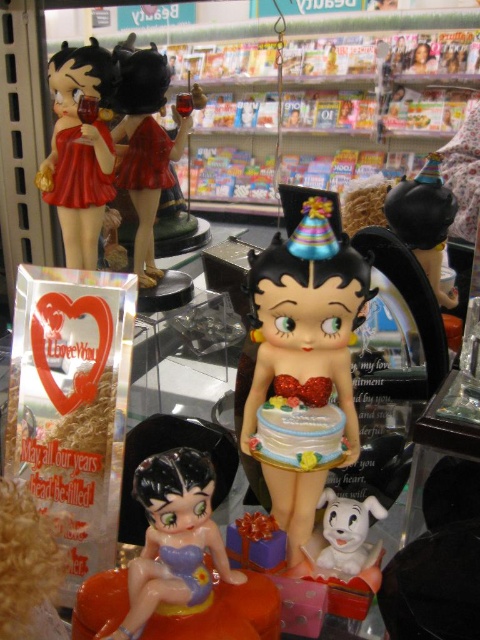
You are a delivery person who needs to place a new 12 inch long package between the matte plastic figurine at upper left and the shiny black figurine at upper right on the shelf. Can you fit the package between them without moving either figurine?

The distance between the matte plastic figurine at upper left and the shiny black figurine at upper right is 20.30 inches. Since the package is 12 inches long, there is enough space to fit it between them without moving either figurine.

Consider the image. You are a customer in the store looking at the Betty Boop figurines displayed on the glass shelf. You notice two points marked on the shelf. Which of these two points, point (407, 35) or point (162, 460), is closer to you?

Point (407, 35) is further to the camera than point (162, 460), so point (162, 460) is closer to you.